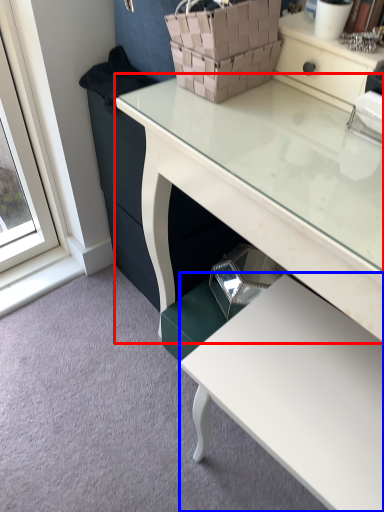
Question: Which object is closer to the camera taking this photo, desk (highlighted by a red box) or table (highlighted by a blue box)?

Choices:
 (A) desk
 (B) table

Answer: (A)